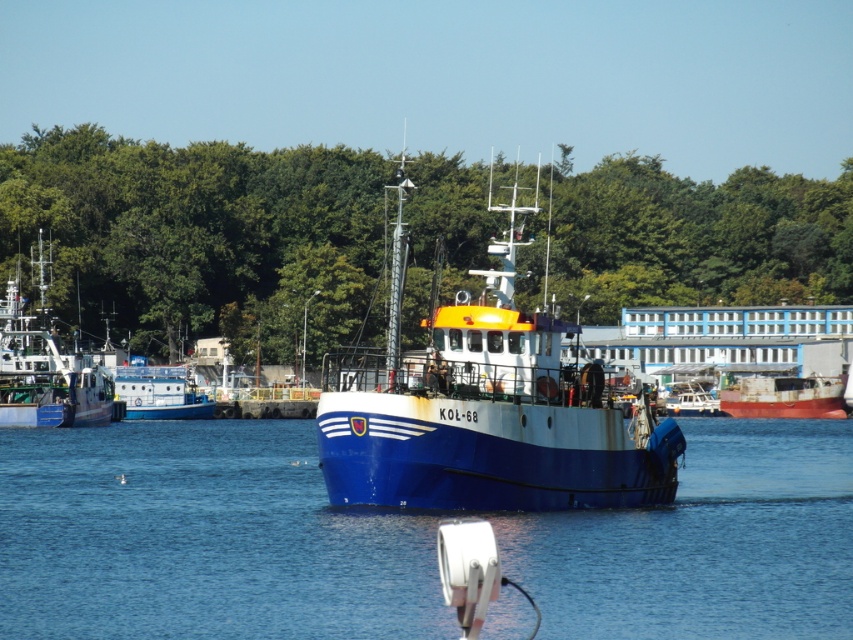
Who is lower down, blue matte boat at center or blue matte fishing boat at left?

blue matte fishing boat at left

Is point (389, 406) farther from viewer compared to point (96, 371)?

No, it is not.

Where is `blue matte boat at center`? blue matte boat at center is located at coordinates (490, 413).

Who is shorter, blue water at center or blue matte boat at center?

blue water at center

This screenshot has width=853, height=640. Identify the location of blue water at center. (201, 538).

Find the location of `blue water at center`. blue water at center is located at coordinates (201, 538).

Can you confirm if rusty metal ship at lower right is positioned above blue matte boat at left?

Incorrect, rusty metal ship at lower right is not positioned above blue matte boat at left.

Does rusty metal ship at lower right lie behind blue matte boat at left?

Yes, it is.

Is point (755, 392) positioned in front of point (125, 385)?

No.

Locate an element on the screen. The height and width of the screenshot is (640, 853). rusty metal ship at lower right is located at coordinates (785, 397).